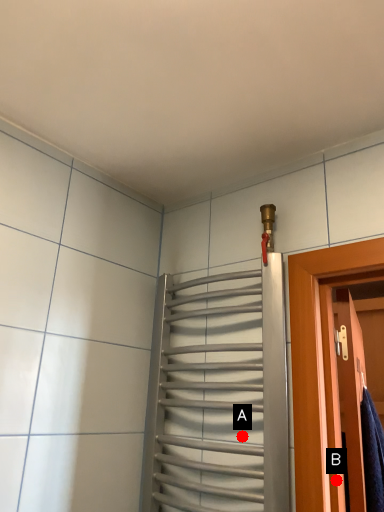
Question: Two points are circled on the image, labeled by A and B beside each circle. Which point is closer to the camera?

Choices:
 (A) A is closer
 (B) B is closer

Answer: (B)